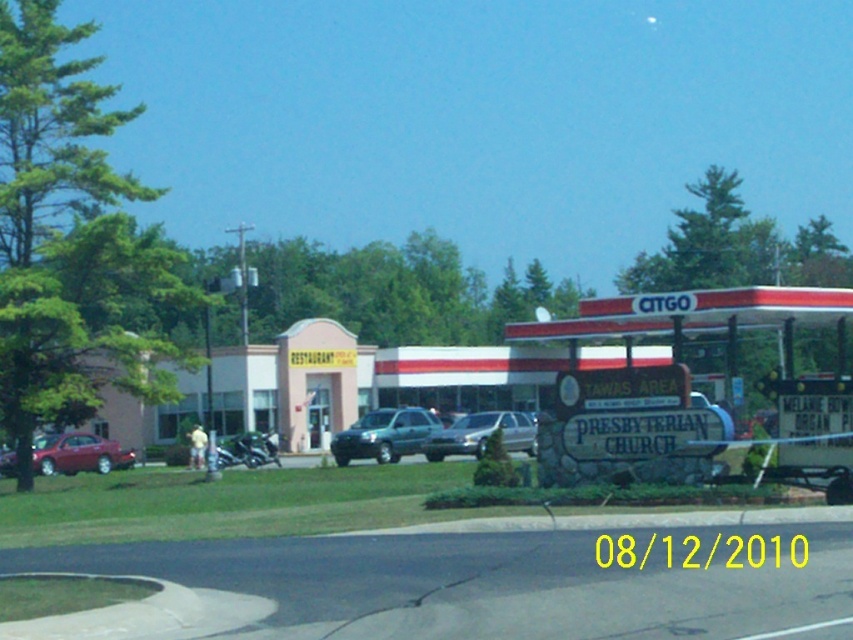
Between green matte suv at center and shiny red sedan at left, which one has less height?

shiny red sedan at left

Does green matte suv at center come behind shiny red sedan at left?

That is False.

Does point (374, 429) lie in front of point (96, 460)?

That is True.

Identify the location of green matte suv at center. The height and width of the screenshot is (640, 853). (384, 435).

Is stone signboard at center bigger than satin silver sedan at center?

Yes.

Does stone signboard at center have a lesser height compared to satin silver sedan at center?

Incorrect, stone signboard at center's height does not fall short of satin silver sedan at center's.

Which is behind, point (817, 480) or point (534, 422)?

Positioned behind is point (534, 422).

The width and height of the screenshot is (853, 640). Find the location of `stone signboard at center`. stone signboard at center is located at coordinates (689, 387).

Which is more to the left, stone signboard at center or metallic silver motorcycle at center?

metallic silver motorcycle at center

Does stone signboard at center appear over metallic silver motorcycle at center?

Yes, stone signboard at center is above metallic silver motorcycle at center.

Between point (619, 419) and point (222, 460), which one is positioned in front?

Point (619, 419) is more forward.

The height and width of the screenshot is (640, 853). I want to click on stone signboard at center, so click(689, 387).